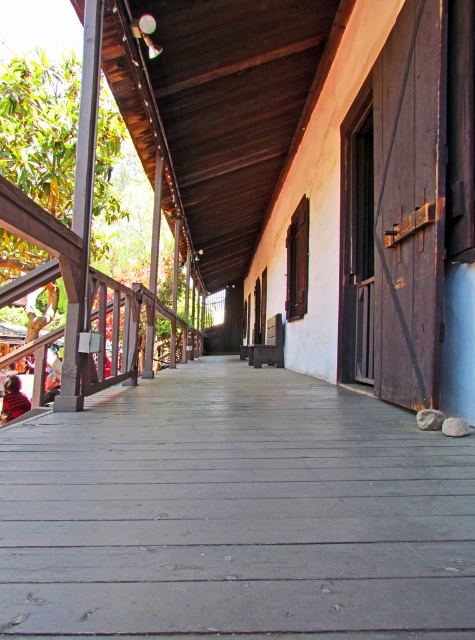
Who is more distant from viewer, (276, 500) or (24, 401)?

Point (24, 401)

Is point (263, 588) farther from viewer compared to point (10, 400)?

No, (263, 588) is closer to viewer.

This screenshot has width=475, height=640. Describe the element at coordinates (235, 515) in the screenshot. I see `smooth gray wood porch at center` at that location.

Locate an element on the screen. smooth gray wood porch at center is located at coordinates (235, 515).